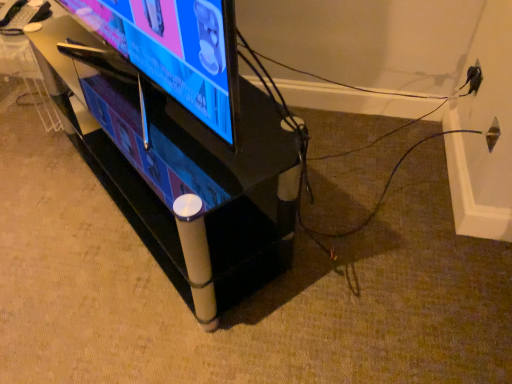
Question: From the image's perspective, is black glossy tv stand at center positioned above or below matte black tv at center?

Choices:
 (A) below
 (B) above

Answer: (A)

Question: Relative to matte black tv at center, is black glossy tv stand at center in front or behind?

Choices:
 (A) front
 (B) behind

Answer: (B)

Question: From a real-world perspective, is black glossy tv stand at center physically located above or below matte black tv at center?

Choices:
 (A) below
 (B) above

Answer: (A)

Question: Does point (216, 1) appear closer or farther from the camera than point (97, 155)?

Choices:
 (A) closer
 (B) farther

Answer: (A)

Question: Considering the positions of matte black tv at center and black glossy tv stand at center in the image, is matte black tv at center wider or thinner than black glossy tv stand at center?

Choices:
 (A) wide
 (B) thin

Answer: (B)

Question: Do you think matte black tv at center is within black glossy tv stand at center, or outside of it?

Choices:
 (A) outside
 (B) inside

Answer: (A)

Question: Is matte black tv at center to the left or to the right of black glossy tv stand at center in the image?

Choices:
 (A) left
 (B) right

Answer: (A)